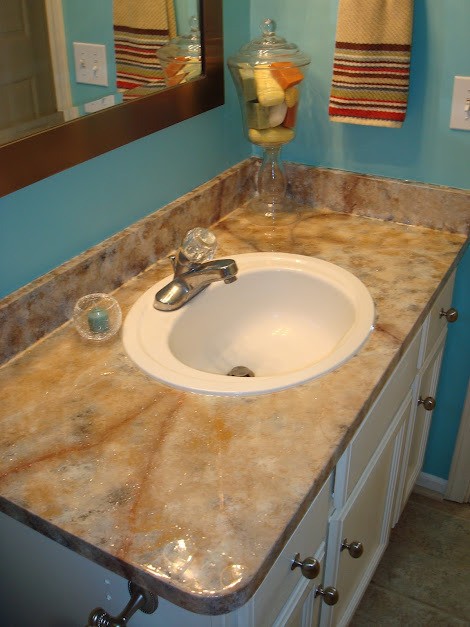
This screenshot has width=470, height=627. I want to click on mirrow, so click(x=87, y=45).